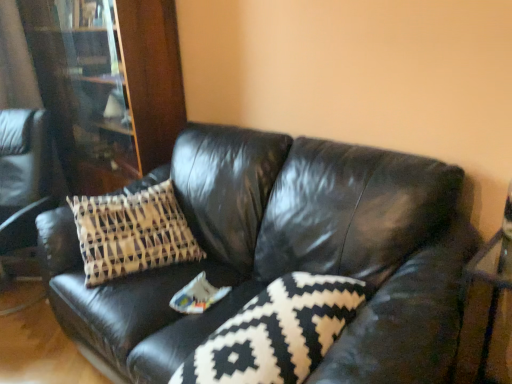
At what (x,y) coordinates should I click in order to perform the action: click on wooden bookcase at left. Please return your answer as a coordinate pair (x, y). The width and height of the screenshot is (512, 384). Looking at the image, I should click on (106, 85).

What is the approximate height of black and white patterned pillow at center?

It is 20.46 centimeters.

Describe the element at coordinates (277, 332) in the screenshot. This screenshot has width=512, height=384. I see `black and white patterned pillow at center` at that location.

Image resolution: width=512 pixels, height=384 pixels. Identify the location of black leather couch at center. (284, 254).

Identify the location of wooden bookcase at left. (106, 85).

Considering the relative sizes of black leather couch at center and black and white patterned pillow at center in the image provided, is black leather couch at center taller than black and white patterned pillow at center?

Correct, black leather couch at center is much taller as black and white patterned pillow at center.

From the image's perspective, is black leather couch at center above or below black and white patterned pillow at center?

black leather couch at center is above black and white patterned pillow at center.

Does black leather couch at center have a greater width compared to black and white patterned pillow at center?

Yes.

From the image's perspective, does wooden bookcase at left appear lower than black leather couch at center?

Actually, wooden bookcase at left appears above black leather couch at center in the image.

Do you think wooden bookcase at left is within black leather couch at center, or outside of it?

wooden bookcase at left exists outside the volume of black leather couch at center.

Can you see wooden bookcase at left touching black leather couch at center?

No, wooden bookcase at left is not next to black leather couch at center.

Where is `bookcase on the left of the black leather couch at center`? The image size is (512, 384). bookcase on the left of the black leather couch at center is located at coordinates (106, 85).

Which is nearer, (179, 111) or (328, 342)?

The point (328, 342) is closer to the camera.

Measure the distance from wooden bookcase at left to black and white patterned pillow at center.

A distance of 5.14 feet exists between wooden bookcase at left and black and white patterned pillow at center.

Is wooden bookcase at left positioned with its back to black and white patterned pillow at center?

That's not correct — wooden bookcase at left is not looking away from black and white patterned pillow at center.

Is wooden bookcase at left far away from black and white patterned pillow at center?

Yes, wooden bookcase at left and black and white patterned pillow at center are located far from each other.

Which object is more forward, black and white patterned pillow at center or wooden bookcase at left?

black and white patterned pillow at center is more forward.

Is black and white patterned pillow at center not within wooden bookcase at left?

Yes, black and white patterned pillow at center is located beyond the bounds of wooden bookcase at left.

From a real-world perspective, is black and white patterned pillow at center positioned above or below wooden bookcase at left?

black and white patterned pillow at center is below wooden bookcase at left.

From the image's perspective, is black and white patterned pillow at center located above wooden bookcase at left?

No, from the image's perspective, black and white patterned pillow at center is not over wooden bookcase at left.

In the scene shown: Are black and white patterned pillow at center and black leather couch at center making contact?

black and white patterned pillow at center and black leather couch at center are not in contact.

Can you tell me how much black and white patterned pillow at center and black leather couch at center differ in facing direction?

black and white patterned pillow at center and black leather couch at center are facing 3.25 degrees away from each other.

From the image's perspective, does black and white patterned pillow at center appear lower than black leather couch at center?

Yes, from the image's perspective, black and white patterned pillow at center is below black leather couch at center.

Between black leather couch at center and wooden bookcase at left, which one has larger width?

black leather couch at center.

Who is taller, black leather couch at center or wooden bookcase at left?

wooden bookcase at left.

Is black leather couch at center turned away from wooden bookcase at left?

No, wooden bookcase at left is not at the back of black leather couch at center.

Identify the location of pillow above the black leather couch at center (from a real-world perspective). The image size is (512, 384). (277, 332).

The image size is (512, 384). In order to click on studio couch below the wooden bookcase at left (from a real-world perspective) in this screenshot , I will do `click(284, 254)`.

Which object lies further to the anchor point black leather couch at center, black and white patterned pillow at center or wooden bookcase at left?

wooden bookcase at left lies further to black leather couch at center than the other object.

When comparing their distances from black and white patterned pillow at center, does black leather couch at center or wooden bookcase at left seem closer?

black leather couch at center is closer to black and white patterned pillow at center.

Which object lies nearer to the anchor point wooden bookcase at left, black leather couch at center or black and white patterned pillow at center?

black leather couch at center.

Estimate the real-world distances between objects in this image. Which object is further from black and white patterned pillow at center, wooden bookcase at left or black leather couch at center?

wooden bookcase at left is positioned further to the anchor black and white patterned pillow at center.

Considering their positions, is wooden bookcase at left positioned further to black leather couch at center than black and white patterned pillow at center?

The object further to black leather couch at center is wooden bookcase at left.

Which object lies further to the anchor point wooden bookcase at left, black and white patterned pillow at center or black leather couch at center?

The object further to wooden bookcase at left is black and white patterned pillow at center.

The width and height of the screenshot is (512, 384). Find the location of `pillow between black leather couch at center and wooden bookcase at left in the front-back direction`. pillow between black leather couch at center and wooden bookcase at left in the front-back direction is located at coordinates (277, 332).